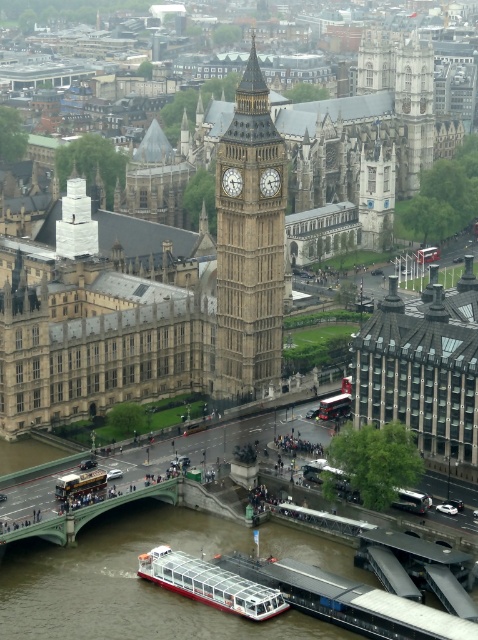
Question: Does white glass boat at lower center appear under gold metallic double-decker bus at center?

Choices:
 (A) no
 (B) yes

Answer: (B)

Question: Does golden stone building at center lie in front of golden stone clock tower at center?

Choices:
 (A) no
 (B) yes

Answer: (A)

Question: Is golden stone building at center to the right of white glass boat at lower center from the viewer's perspective?

Choices:
 (A) no
 (B) yes

Answer: (A)

Question: Among these objects, which one is nearest to the camera?

Choices:
 (A) golden stone building at center
 (B) gold metallic double-decker bus at center

Answer: (B)

Question: Which point is farther to the camera?

Choices:
 (A) gold metallic double-decker bus at center
 (B) green painted concrete bridge at center

Answer: (A)

Question: Which object is farther from the camera taking this photo?

Choices:
 (A) green painted concrete bridge at center
 (B) gold metallic double-decker bus at center

Answer: (B)